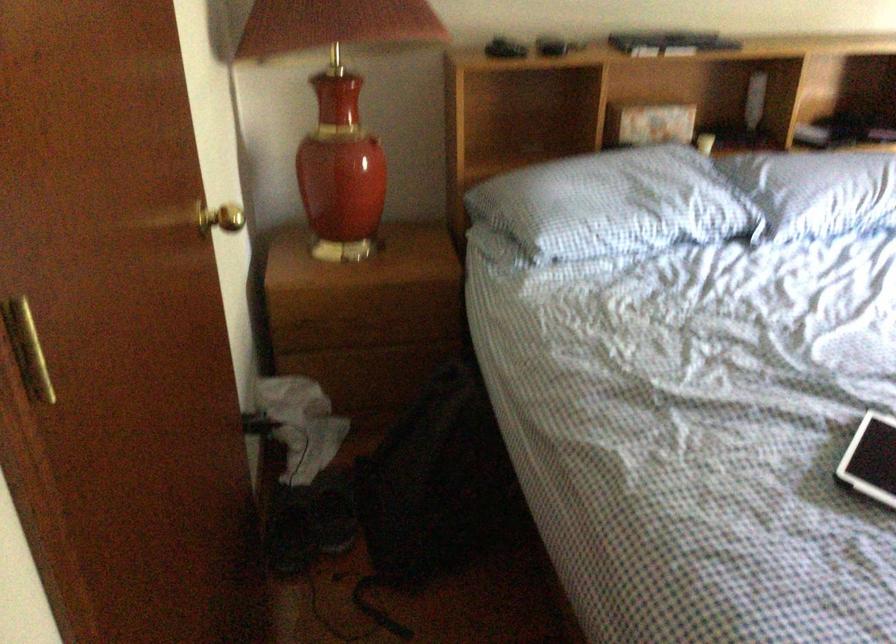
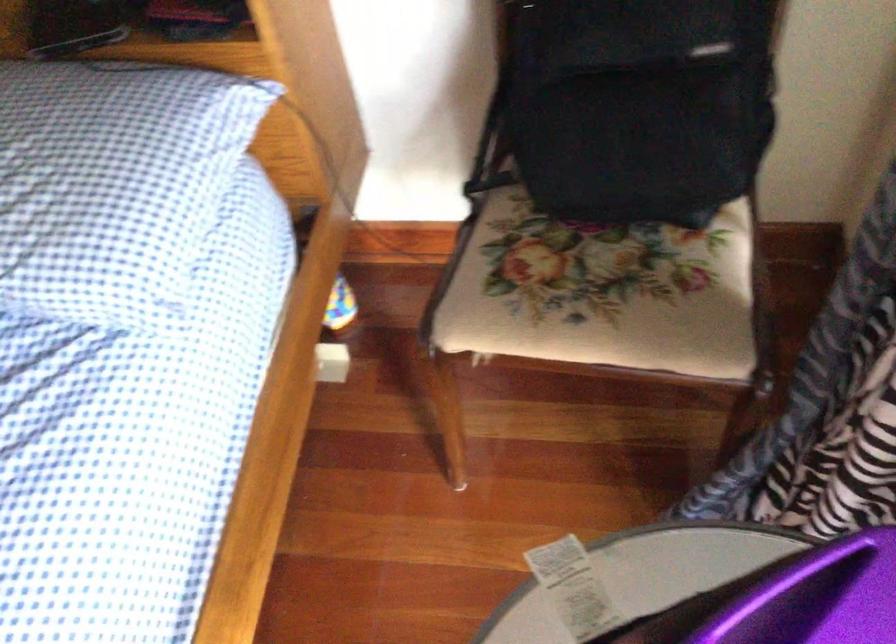
The images are taken continuously from a first-person perspective. In which direction are you moving?

The cameraman moved toward right, forward.